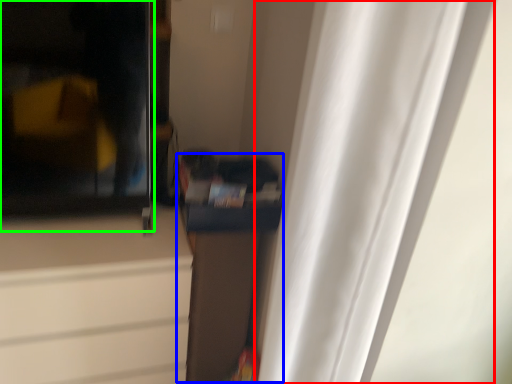
Question: Based on their relative distances, which object is nearer to curtain (highlighted by a red box)? Choose from cabinetry (highlighted by a blue box) and screen door (highlighted by a green box).

Choices:
 (A) cabinetry
 (B) screen door

Answer: (A)